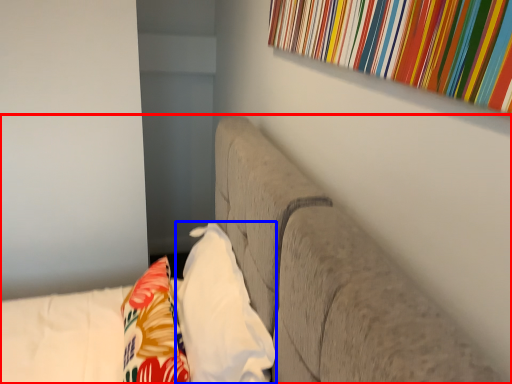
Question: Which object appears closest to the camera in this image, furniture (highlighted by a red box) or pillow (highlighted by a blue box)?

Choices:
 (A) furniture
 (B) pillow

Answer: (A)